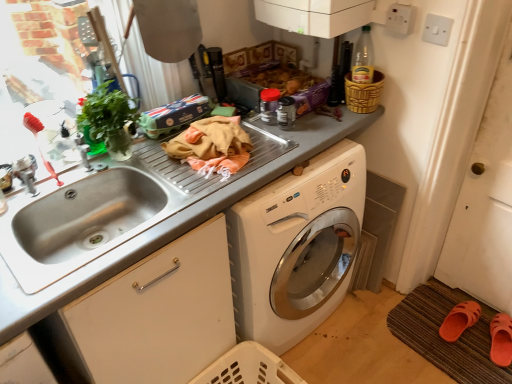
Question: In terms of size, does white matte screen door at right appear bigger or smaller than gray matte countertop at center?

Choices:
 (A) small
 (B) big

Answer: (A)

Question: From the image's perspective, is white matte screen door at right located above or below gray matte countertop at center?

Choices:
 (A) below
 (B) above

Answer: (B)

Question: Estimate the real-world distances between objects in this image. Which object is closer to the brown woven mat at lower right?

Choices:
 (A) green leafy plant at left
 (B) stainless steel sink at left
 (C) orange rubber slipper at lower right
 (D) white matte screen door at right
 (E) bamboo textured basket at upper right

Answer: (C)

Question: Which of these objects is positioned farthest from the gray matte countertop at center?

Choices:
 (A) green leafy plant at left
 (B) orange rubber slipper at lower right
 (C) white matte screen door at right
 (D) white plastic switch at upper right, the 1th electric outlet when ordered from right to left
 (E) stainless steel sink at left

Answer: (B)